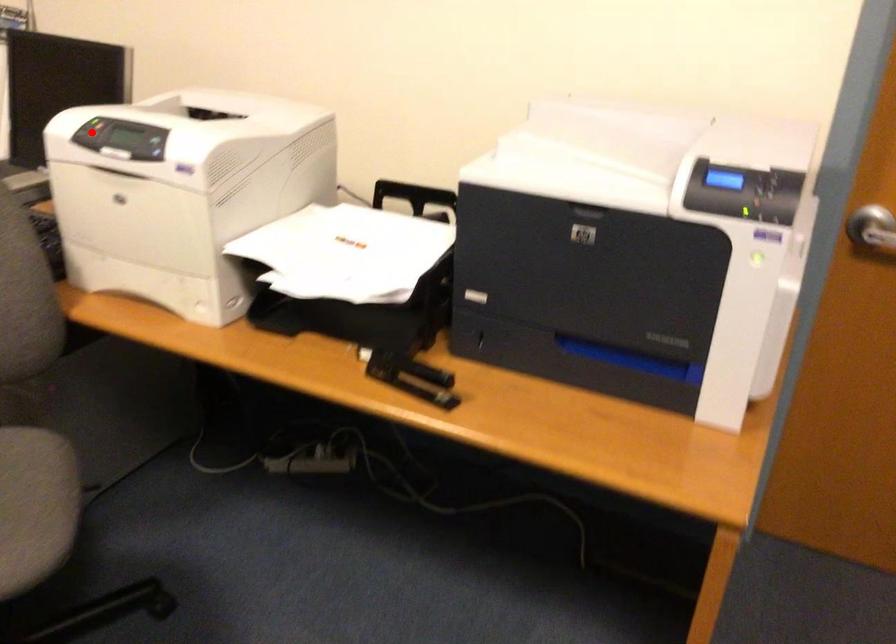
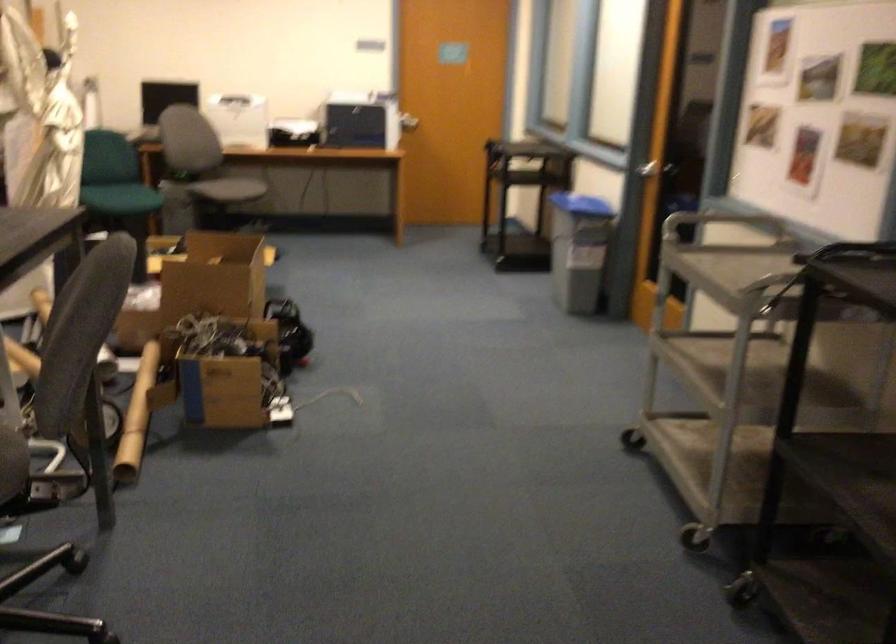
Question: I am providing you with two images of the same scene from different viewpoints. A red point is marked on the first image. Can you still see the location of the red point in image 2?

Choices:
 (A) Yes
 (B) No

Answer: (B)